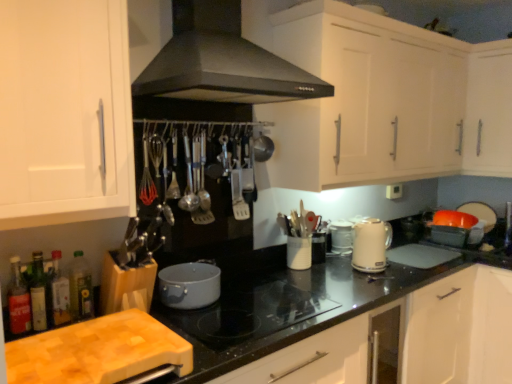
The image size is (512, 384). In order to click on translucent glass bottle at lower left, positioned as the first bottle in left-to-right order in this screenshot , I will do `click(18, 300)`.

What do you see at coordinates (80, 287) in the screenshot? I see `green matte bottle at lower left, which is the fourth bottle in left-to-right order` at bounding box center [80, 287].

This screenshot has height=384, width=512. Describe the element at coordinates (221, 61) in the screenshot. I see `black matte range hood at upper center` at that location.

In order to face white ceramic kettle at center-right, arranged as the 3th appliance when viewed from the right, should I rotate leftwards or rightwards?

To align with it, rotate right about 11.749°.

Describe the element at coordinates (286, 305) in the screenshot. I see `wooden cutting board at lower left, marked as the 3th cabinetry in a top-to-bottom arrangement` at that location.

What do you see at coordinates (480, 213) in the screenshot?
I see `orange plastic bowl at upper right, which ranks as the first appliance in right-to-left order` at bounding box center [480, 213].

You are a GUI agent. You are given a task and a screenshot of the screen. Output one action in this format:
    pyautogui.click(x=<x>, y=<y>)
    Task: Click on the translucent glass bottle at lower left, marked as the fourth bottle in a right-to-left arrangement
    This screenshot has height=384, width=512.
    Given the screenshot: What is the action you would take?
    pyautogui.click(x=18, y=300)

Is red rubber whisk at upper left at the back of black matte range hood at upper center?

No, black matte range hood at upper center is not facing away from red rubber whisk at upper left.

Looking at this image, does black matte range hood at upper center have a greater height compared to red rubber whisk at upper left?

Yes, black matte range hood at upper center is taller than red rubber whisk at upper left.

What's the angular difference between black matte range hood at upper center and red rubber whisk at upper left's facing directions?

The angle between the facing direction of black matte range hood at upper center and the facing direction of red rubber whisk at upper left is 1.01 degrees.

Does translucent glass bottle at lower left, positioned as the first bottle in left-to-right order, lie in front of black matte range hood at upper center?

No, it is not.

Who is smaller, translucent glass bottle at lower left, marked as the fourth bottle in a right-to-left arrangement, or black matte range hood at upper center?

translucent glass bottle at lower left, marked as the fourth bottle in a right-to-left arrangement, is smaller.

Is translucent glass bottle at lower left, marked as the fourth bottle in a right-to-left arrangement, positioned beyond the bounds of black matte range hood at upper center?

That's correct, translucent glass bottle at lower left, marked as the fourth bottle in a right-to-left arrangement, is outside of black matte range hood at upper center.

Visually, is translucent glass bottle at lower left, positioned as the first bottle in left-to-right order, positioned to the left or to the right of black matte range hood at upper center?

Based on their positions, translucent glass bottle at lower left, positioned as the first bottle in left-to-right order, is located to the left of black matte range hood at upper center.

Is red rubber whisk at upper left in front of or behind translucent glass bottle at lower left, which is the third bottle from right to left, in the image?

red rubber whisk at upper left is behind translucent glass bottle at lower left, which is the third bottle from right to left.

Visually, is red rubber whisk at upper left positioned to the left or to the right of translucent glass bottle at lower left, which is the third bottle from right to left?

red rubber whisk at upper left is to the right of translucent glass bottle at lower left, which is the third bottle from right to left.

From the picture: From a real-world perspective, is red rubber whisk at upper left under translucent glass bottle at lower left, the second bottle in the left-to-right sequence?

No, from a real-world perspective, red rubber whisk at upper left is not below translucent glass bottle at lower left, the second bottle in the left-to-right sequence.

Is red rubber whisk at upper left bigger or smaller than translucent glass bottle at lower left, the second bottle in the left-to-right sequence?

red rubber whisk at upper left is bigger than translucent glass bottle at lower left, the second bottle in the left-to-right sequence.

From the picture: From a real-world perspective, is white matte cabinet at left, acting as the second cabinetry starting from the top, located beneath wooden cutting board at lower left?

No, from a real-world perspective, white matte cabinet at left, acting as the second cabinetry starting from the top, is not under wooden cutting board at lower left.

Can you confirm if white matte cabinet at left, acting as the second cabinetry starting from the top, is thinner than wooden cutting board at lower left?

Indeed, white matte cabinet at left, acting as the second cabinetry starting from the top, has a lesser width compared to wooden cutting board at lower left.

Measure the distance between white matte cabinet at left, acting as the second cabinetry starting from the top, and wooden cutting board at lower left.

The distance of white matte cabinet at left, acting as the second cabinetry starting from the top, from wooden cutting board at lower left is 20.25 inches.

Which is correct: white matte cabinet at left, the 2th cabinetry positioned from the bottom, is inside wooden cutting board at lower left, or outside of it?

white matte cabinet at left, the 2th cabinetry positioned from the bottom, cannot be found inside wooden cutting board at lower left.

Considering the sizes of orange plastic bowl at right, which is the second appliance in right-to-left order, and wooden cutting board at lower left in the image, is orange plastic bowl at right, which is the second appliance in right-to-left order, wider or thinner than wooden cutting board at lower left?

Considering their sizes, orange plastic bowl at right, which is the second appliance in right-to-left order, looks broader than wooden cutting board at lower left.

Can you confirm if orange plastic bowl at right, positioned as the fourth appliance in front-to-back order, is taller than wooden cutting board at lower left?

Yes, orange plastic bowl at right, positioned as the fourth appliance in front-to-back order, is taller than wooden cutting board at lower left.

Looking at this image, is there a large distance between orange plastic bowl at right, which is the 2th appliance from back to front, and wooden cutting board at lower left?

Yes, orange plastic bowl at right, which is the 2th appliance from back to front, and wooden cutting board at lower left are located far from each other.

Does green matte bottle at lower left, which is the fourth bottle in left-to-right order, appear on the right side of translucent glass bottle at lower left, positioned as the first bottle in left-to-right order?

Yes, green matte bottle at lower left, which is the fourth bottle in left-to-right order, is to the right of translucent glass bottle at lower left, positioned as the first bottle in left-to-right order.

Does green matte bottle at lower left, which is the fourth bottle in left-to-right order, have a smaller size compared to translucent glass bottle at lower left, positioned as the first bottle in left-to-right order?

Correct, green matte bottle at lower left, which is the fourth bottle in left-to-right order, occupies less space than translucent glass bottle at lower left, positioned as the first bottle in left-to-right order.

Is green matte bottle at lower left, arranged as the first bottle when viewed from the right, facing away from translucent glass bottle at lower left, marked as the fourth bottle in a right-to-left arrangement?

green matte bottle at lower left, arranged as the first bottle when viewed from the right, is not turned away from translucent glass bottle at lower left, marked as the fourth bottle in a right-to-left arrangement.

Is translucent glass bottle at lower left, which is the third bottle from right to left, in contact with wooden cutting board at lower left?

They are not placed beside each other.

From a real-world perspective, who is located higher, translucent glass bottle at lower left, which is the third bottle from right to left, or wooden cutting board at lower left?

In real-world perspective, translucent glass bottle at lower left, which is the third bottle from right to left, is above.

Considering the positions of objects translucent glass bottle at lower left, the second bottle in the left-to-right sequence, and wooden cutting board at lower left in the image provided, who is more to the left, translucent glass bottle at lower left, the second bottle in the left-to-right sequence, or wooden cutting board at lower left?

From the viewer's perspective, translucent glass bottle at lower left, the second bottle in the left-to-right sequence, appears more on the left side.

Could you tell me if translucent glass bottle at lower left, the second bottle in the left-to-right sequence, is turned towards wooden cutting board at lower left?

Yes, translucent glass bottle at lower left, the second bottle in the left-to-right sequence, is oriented towards wooden cutting board at lower left.

The width and height of the screenshot is (512, 384). I want to click on silverware below the black matte range hood at upper center (from a real-world perspective), so tap(146, 171).

Locate an element on the screen. The height and width of the screenshot is (384, 512). home appliance in front of the translucent glass bottle at lower left, positioned as the first bottle in left-to-right order is located at coordinates (221, 61).

From the image, which object appears to be farther from translucent glass bottle at lower left, positioned as the first bottle in left-to-right order, white matte cabinet at left, acting as the second cabinetry starting from the top, or smooth black cooktop at center?

smooth black cooktop at center lies further to translucent glass bottle at lower left, positioned as the first bottle in left-to-right order, than the other object.

Looking at this image, based on their spatial positions, is white matte cabinet at left, the 2th cabinetry positioned from the bottom, or wooden cutting board at lower left, marked as the 3th cabinetry in a top-to-bottom arrangement, closer to matte gray pot at center, arranged as the 5th appliance when viewed from the right?

wooden cutting board at lower left, marked as the 3th cabinetry in a top-to-bottom arrangement, is closer to matte gray pot at center, arranged as the 5th appliance when viewed from the right.

Looking at the image, which one is located further to translucent glass bottle at lower left, which is the third bottle from right to left, orange plastic bowl at upper right, placed as the 5th appliance when sorted from front to back, or green matte bottle at lower left, which is the fourth bottle in left-to-right order?

orange plastic bowl at upper right, placed as the 5th appliance when sorted from front to back, lies further to translucent glass bottle at lower left, which is the third bottle from right to left, than the other object.

Based on their spatial positions, is red rubber whisk at upper left or matte gray pot at center, acting as the first appliance starting from the front, closer to green matte bottle at lower left, which is the fourth bottle in left-to-right order?

matte gray pot at center, acting as the first appliance starting from the front, is closer to green matte bottle at lower left, which is the fourth bottle in left-to-right order.

Based on their spatial positions, is white glossy sink at upper right or black matte range hood at upper center further from wooden cutting board at lower left?

white glossy sink at upper right is positioned further to the anchor wooden cutting board at lower left.

Based on their spatial positions, is translucent glass bottle at lower left, positioned as the first bottle in left-to-right order, or white ceramic kettle at center-right, the 3th appliance in the left-to-right sequence, further from white glossy sink at upper right?

Among the two, translucent glass bottle at lower left, positioned as the first bottle in left-to-right order, is located further to white glossy sink at upper right.

Which object lies nearer to the anchor point white ceramic kettle at center-right, arranged as the 3th appliance when viewed from the right, white glossy sink at upper right or red rubber whisk at upper left?

white glossy sink at upper right is positioned closer to the anchor white ceramic kettle at center-right, arranged as the 3th appliance when viewed from the right.

From the image, which object appears to be farther from orange plastic bowl at upper right, which ranks as the first appliance in right-to-left order, smooth black cooktop at center or translucent glass bottle at lower left, positioned as the first bottle in left-to-right order?

translucent glass bottle at lower left, positioned as the first bottle in left-to-right order, lies further to orange plastic bowl at upper right, which ranks as the first appliance in right-to-left order, than the other object.

Where is `cutting board between white matte cabinet at left, acting as the second cabinetry starting from the top, and orange plastic bowl at right, marked as the 4th appliance in a left-to-right arrangement`? cutting board between white matte cabinet at left, acting as the second cabinetry starting from the top, and orange plastic bowl at right, marked as the 4th appliance in a left-to-right arrangement is located at coordinates (98, 351).

Find the location of `kitchen appliance between red rubber whisk at upper left and white matte cabinet at upper right, which ranks as the 1th cabinetry in top-to-bottom order`. kitchen appliance between red rubber whisk at upper left and white matte cabinet at upper right, which ranks as the 1th cabinetry in top-to-bottom order is located at coordinates (370, 246).

Locate an element on the screen. This screenshot has height=384, width=512. home appliance between red rubber whisk at upper left and orange plastic bowl at right, marked as the 4th appliance in a left-to-right arrangement is located at coordinates (221, 61).

This screenshot has height=384, width=512. In order to click on silverware between wooden cutting board at lower left and orange plastic bowl at right, which is the second appliance in right-to-left order in this screenshot , I will do `click(146, 171)`.